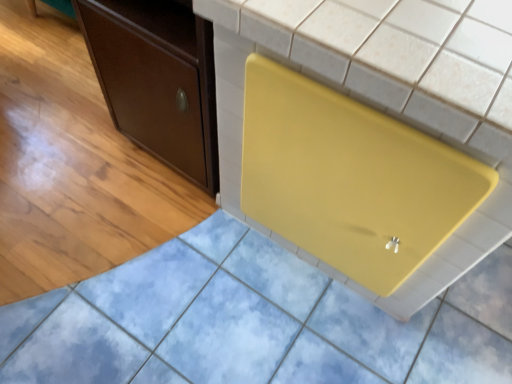
What are the coordinates of `vacant space that is to the left of matte brown cabinet at left` in the screenshot? It's located at (79, 150).